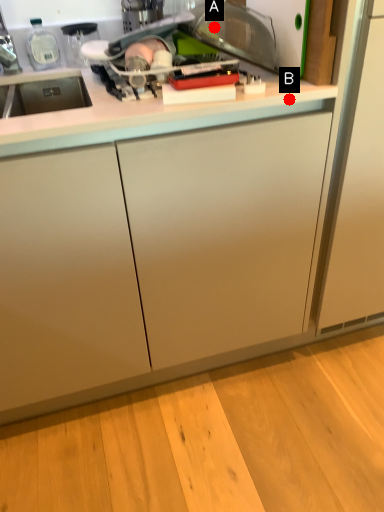
Question: Two points are circled on the image, labeled by A and B beside each circle. Which of the following is the closest to the observer?

Choices:
 (A) A is closer
 (B) B is closer

Answer: (B)